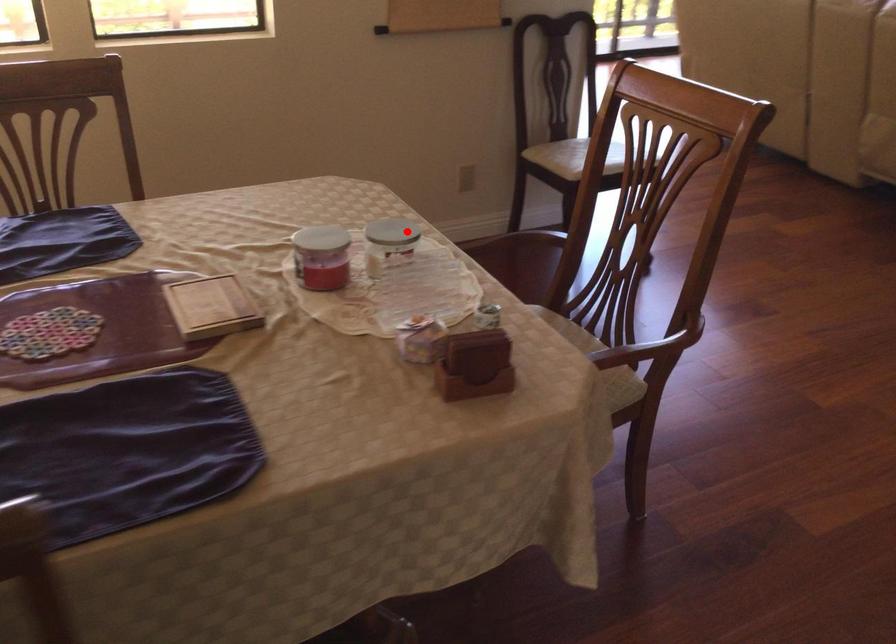
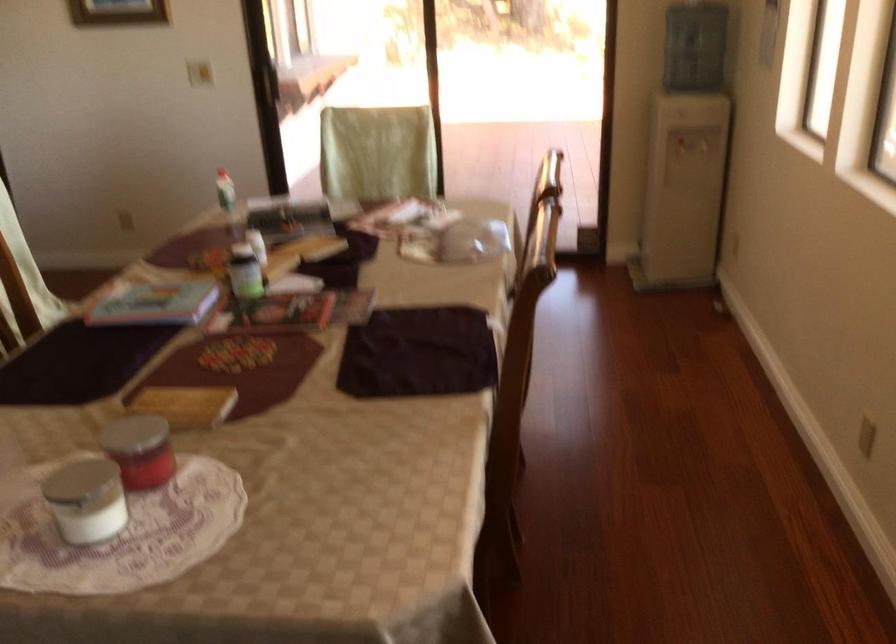
The point at the highlighted location is marked in the first image. Where is the corresponding point in the second image?

(85, 500)